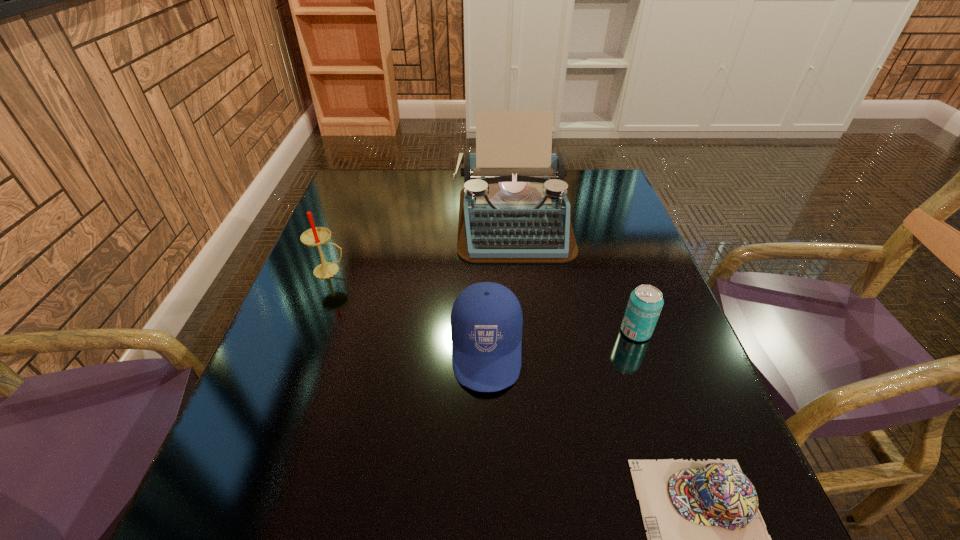
Locate an element on the screen. This screenshot has height=540, width=960. object at the far edge is located at coordinates (514, 209).

This screenshot has height=540, width=960. Identify the location of object that is positioned at the left edge. (315, 236).

Identify the location of object that is at the right edge. (645, 303).

Identify the location of free space at the far edge of the desktop. (431, 196).

At what (x,y) coordinates should I click in order to perform the action: click on vacant space at the left edge of the desktop. Please return your answer as a coordinate pair (x, y). Image resolution: width=960 pixels, height=540 pixels. Looking at the image, I should click on (357, 216).

Find the location of a particular element. The height and width of the screenshot is (540, 960). free spot at the right edge of the desktop is located at coordinates (611, 222).

At what (x,y) coordinates should I click in order to perform the action: click on blank area at the far left corner. Please return your answer as a coordinate pair (x, y). Looking at the image, I should click on (381, 201).

The width and height of the screenshot is (960, 540). Identify the location of vacant area between the typewriter and the leftmost object. (421, 245).

You are a GUI agent. You are given a task and a screenshot of the screen. Output one action in this format:
    pyautogui.click(x=<x>, y=<y>)
    Task: Click on the blank region between the leftmost object and the tallest object
    The width and height of the screenshot is (960, 540).
    Given the screenshot: What is the action you would take?
    pyautogui.click(x=421, y=245)

You are a GUI agent. You are given a task and a screenshot of the screen. Output one action in this format:
    pyautogui.click(x=<x>, y=<y>)
    Task: Click on the blank region between the leftmost object and the farther cap
    The height and width of the screenshot is (540, 960).
    Given the screenshot: What is the action you would take?
    [408, 310]